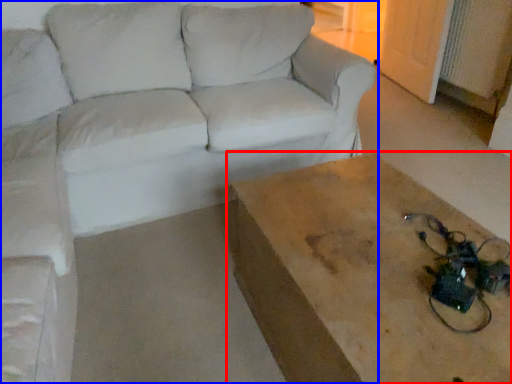
Question: Which point is further to the camera, table (highlighted by a red box) or studio couch (highlighted by a blue box)?

Choices:
 (A) table
 (B) studio couch

Answer: (B)